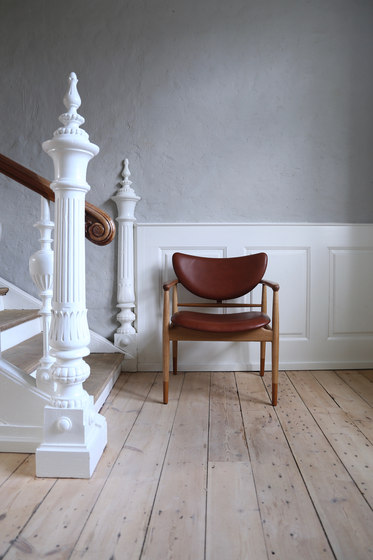
This screenshot has height=560, width=373. In order to click on rightmost leg in this screenshot , I will do `click(276, 319)`.